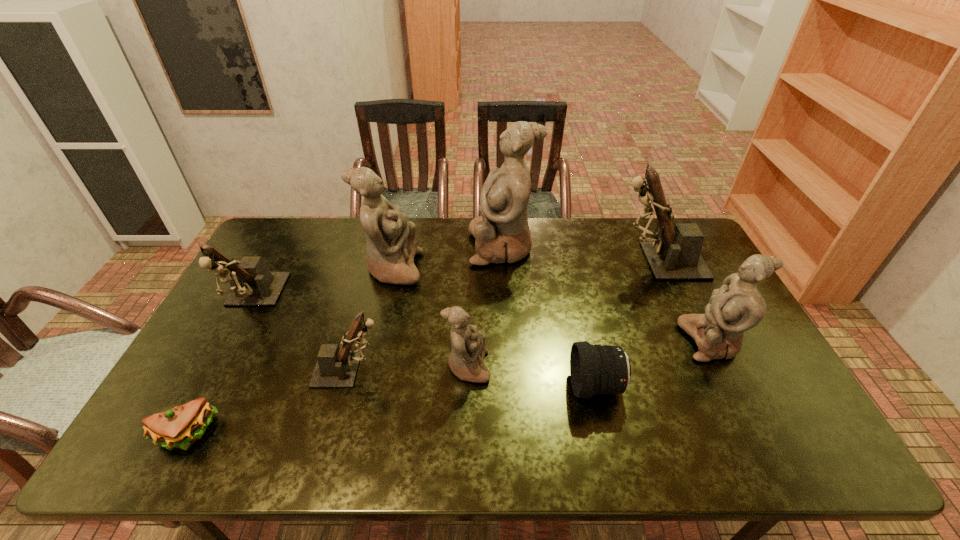
Identify which object is located as the eighth nearest to the rightmost brown figurine. Please provide its 2D coordinates. Your answer should be formatted as a tuple, i.e. [(x, y)], where the tuple contains the x and y coordinates of a point satisfying the conditions above.

[(180, 427)]

Locate which object ranks seventh in proximity to the nearest object. Please provide its 2D coordinates. Your answer should be formatted as a tuple, i.e. [(x, y)], where the tuple contains the x and y coordinates of a point satisfying the conditions above.

[(674, 254)]

What are the coordinates of `figurine that is the nearest to the second biggest brown figurine` in the screenshot? It's located at (336, 367).

Locate an element on the screen. figurine that is the third closest to the seventh object from left to right is located at coordinates (674, 254).

Choose which white figurine is the second nearest neighbor to the third biggest white figurine. Please provide its 2D coordinates. Your answer should be formatted as a tuple, i.e. [(x, y)], where the tuple contains the x and y coordinates of a point satisfying the conditions above.

[(466, 360)]

Where is `white figurine that is the second closest to the black telephoto lens`? white figurine that is the second closest to the black telephoto lens is located at coordinates (738, 306).

Identify the location of brown figurine that stands as the closest to the tallest object. (674, 254).

Select which brown figurine is the third closest to the smallest white figurine. Please provide its 2D coordinates. Your answer should be formatted as a tuple, i.e. [(x, y)], where the tuple contains the x and y coordinates of a point satisfying the conditions above.

[(252, 284)]

Locate an element on the screen. This screenshot has width=960, height=540. free space that satisfies the following two spatial constraints: 1. on the front-facing side of the smallest white figurine; 2. on the front side of the shortest object is located at coordinates (466, 434).

Where is `free space that satisfies the following two spatial constraints: 1. on the front-facing side of the leftmost white figurine; 2. on the front side of the nearest object`? This screenshot has width=960, height=540. free space that satisfies the following two spatial constraints: 1. on the front-facing side of the leftmost white figurine; 2. on the front side of the nearest object is located at coordinates (355, 434).